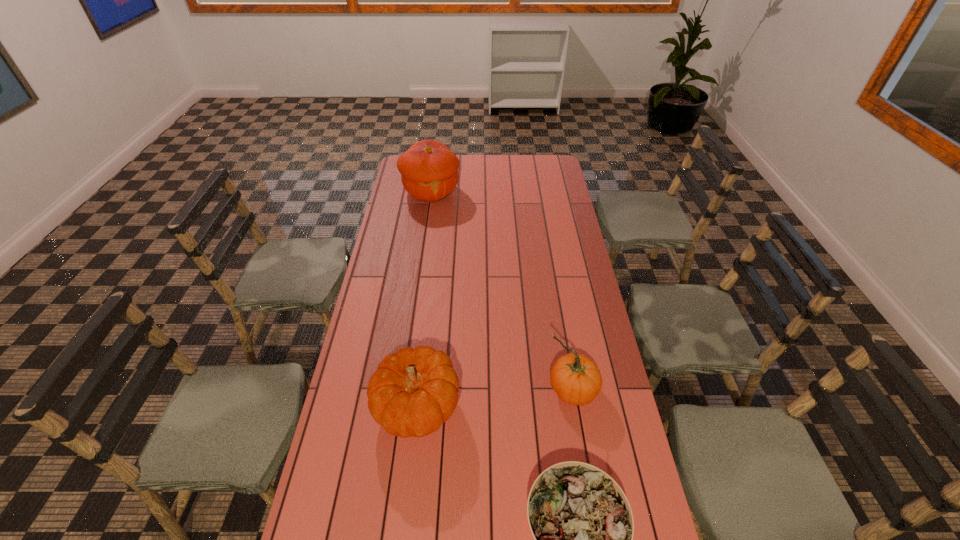
Locate an element on the screen. The image size is (960, 540). vacant space at the left edge of the desktop is located at coordinates (415, 230).

The width and height of the screenshot is (960, 540). In order to click on vacant area at the right edge of the desktop in this screenshot , I will do `click(564, 233)`.

Locate an element on the screen. free space at the far right corner of the desktop is located at coordinates (541, 169).

I want to click on vacant space in between the third tallest object and the farthest pumpkin, so click(424, 300).

I want to click on vacant space in between the rightmost pumpkin and the farthest object, so click(x=501, y=291).

The width and height of the screenshot is (960, 540). Find the location of `object that is the second closest to the farthest object`. object that is the second closest to the farthest object is located at coordinates (576, 379).

Identify which object is located as the third nearest to the salad. Please provide its 2D coordinates. Your answer should be formatted as a tuple, i.e. [(x, y)], where the tuple contains the x and y coordinates of a point satisfying the conditions above.

[(429, 169)]

The image size is (960, 540). In order to click on pumpkin that can be found as the second closest to the shortest pumpkin in this screenshot , I will do `click(429, 169)`.

Where is `pumpkin that stands as the closest to the salad`? The width and height of the screenshot is (960, 540). pumpkin that stands as the closest to the salad is located at coordinates (412, 392).

Where is `free location that satisfies the following two spatial constraints: 1. on the front side of the rightmost pumpkin; 2. on the left side of the farthest object`? free location that satisfies the following two spatial constraints: 1. on the front side of the rightmost pumpkin; 2. on the left side of the farthest object is located at coordinates (403, 389).